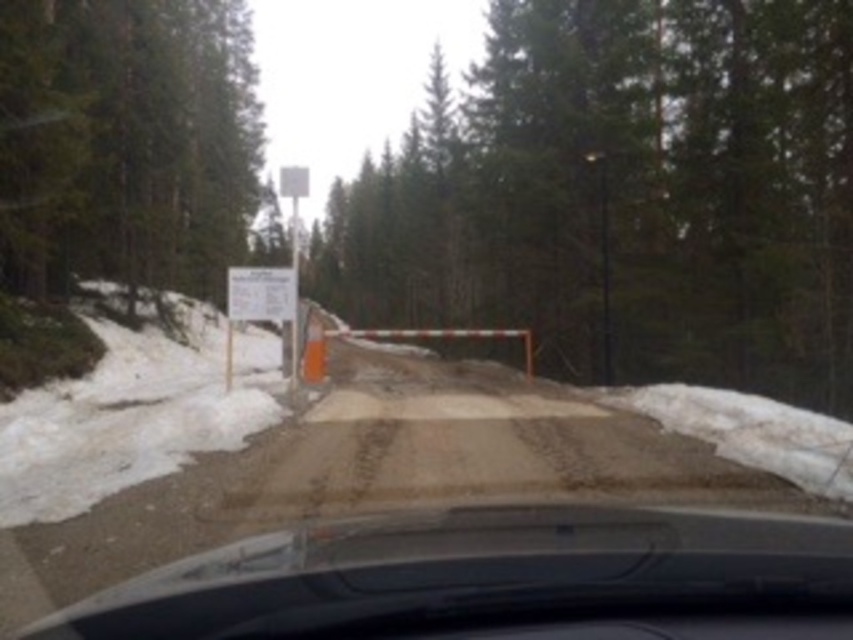
Question: Which object is the closest to the white paper sign at center?

Choices:
 (A) green matte tree at center
 (B) green matte tree at upper left

Answer: (B)

Question: Does green matte tree at upper left have a larger size compared to white paper sign at center?

Choices:
 (A) yes
 (B) no

Answer: (A)

Question: Considering the relative positions of green matte tree at center and green matte tree at upper left in the image provided, where is green matte tree at center located with respect to green matte tree at upper left?

Choices:
 (A) below
 (B) above

Answer: (A)

Question: Among these objects, which one is nearest to the camera?

Choices:
 (A) green matte tree at upper left
 (B) transparent glass windshield at center
 (C) white paper sign at center

Answer: (B)

Question: Is green matte tree at center to the right of transparent glass windshield at center from the viewer's perspective?

Choices:
 (A) no
 (B) yes

Answer: (B)

Question: Among these objects, which one is farthest from the camera?

Choices:
 (A) green matte tree at center
 (B) transparent glass windshield at center

Answer: (A)